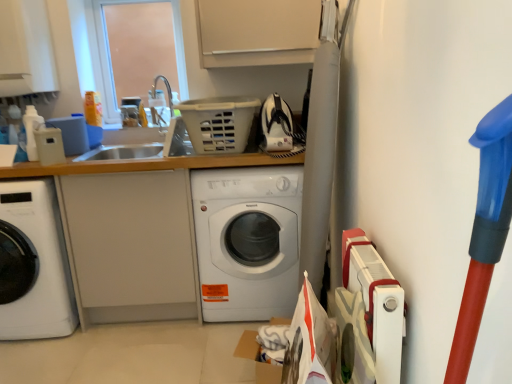
Question: Is white glossy washing machine at left, acting as the second washing machine starting from the right, positioned before white matte counter top at center?

Choices:
 (A) yes
 (B) no

Answer: (A)

Question: Does white glossy washing machine at left, acting as the second washing machine starting from the right, lie behind white matte counter top at center?

Choices:
 (A) no
 (B) yes

Answer: (A)

Question: Is white glossy washing machine at left, acting as the second washing machine starting from the right, shorter than white matte counter top at center?

Choices:
 (A) no
 (B) yes

Answer: (B)

Question: Is white glossy washing machine at left, which appears as the first washing machine when viewed from the left, turned away from white matte counter top at center?

Choices:
 (A) yes
 (B) no

Answer: (A)

Question: Is white glossy washing machine at left, which appears as the first washing machine when viewed from the left, wider than white matte counter top at center?

Choices:
 (A) no
 (B) yes

Answer: (B)

Question: Can you confirm if white glossy washing machine at left, which appears as the first washing machine when viewed from the left, is taller than white matte counter top at center?

Choices:
 (A) no
 (B) yes

Answer: (A)

Question: Does white glossy washing machine at center, marked as the 1th washing machine in a right-to-left arrangement, have a lesser width compared to white glossy washing machine at left, acting as the second washing machine starting from the right?

Choices:
 (A) yes
 (B) no

Answer: (A)

Question: From a real-world perspective, does white glossy washing machine at center, which ranks as the 2th washing machine in left-to-right order, stand above white glossy washing machine at left, acting as the second washing machine starting from the right?

Choices:
 (A) no
 (B) yes

Answer: (A)

Question: Is the depth of white glossy washing machine at center, which ranks as the 2th washing machine in left-to-right order, greater than that of white glossy washing machine at left, which appears as the first washing machine when viewed from the left?

Choices:
 (A) no
 (B) yes

Answer: (B)

Question: From the image's perspective, is white glossy washing machine at center, marked as the 1th washing machine in a right-to-left arrangement, below white glossy washing machine at left, which appears as the first washing machine when viewed from the left?

Choices:
 (A) yes
 (B) no

Answer: (B)

Question: Are white glossy washing machine at center, which ranks as the 2th washing machine in left-to-right order, and white glossy washing machine at left, acting as the second washing machine starting from the right, making contact?

Choices:
 (A) no
 (B) yes

Answer: (A)

Question: Could white glossy washing machine at left, acting as the second washing machine starting from the right, be considered to be inside white glossy washing machine at center, which ranks as the 2th washing machine in left-to-right order?

Choices:
 (A) yes
 (B) no

Answer: (B)

Question: From the image's perspective, is white glossy washing machine at center, marked as the 1th washing machine in a right-to-left arrangement, below white matte counter top at center?

Choices:
 (A) no
 (B) yes

Answer: (B)